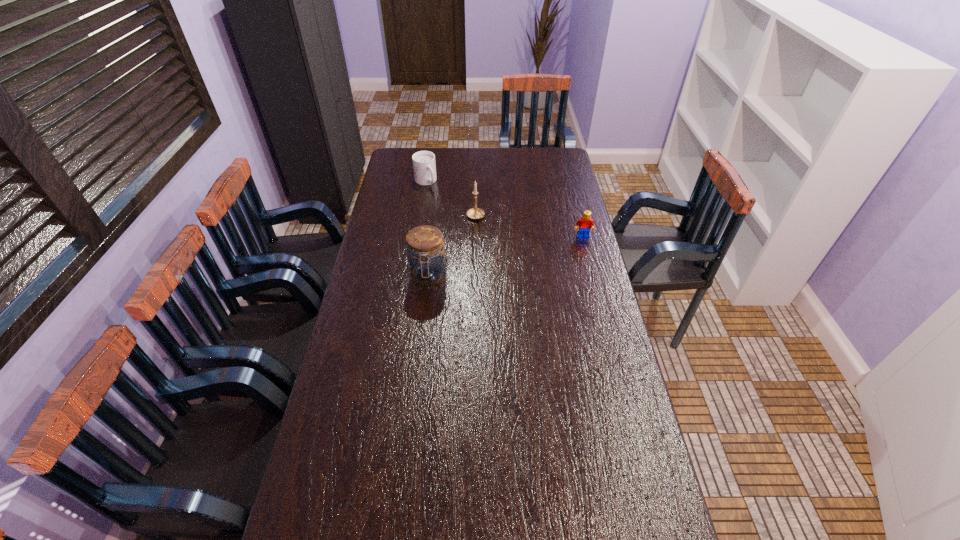
Locate an element on the screen. free space on the desktop that is between the nearest object and the third farthest object and is positioned on the side with the handle of the cappuccino is located at coordinates (488, 261).

This screenshot has height=540, width=960. I want to click on vacant space on the desktop that is between the nearest object and the rightmost object and is positioned on the handle side of the second object from right to left, so click(x=524, y=252).